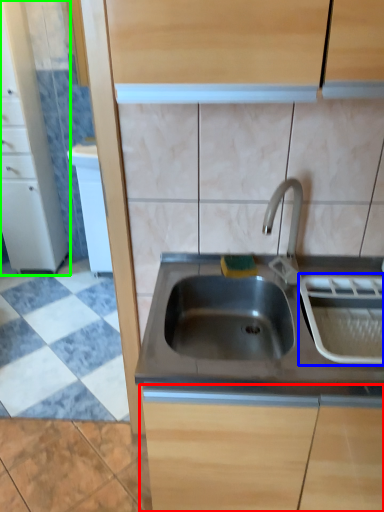
Question: Based on their relative distances, which object is nearer to cabinetry (highlighted by a red box)? Choose from appliance (highlighted by a blue box) and cabinetry (highlighted by a green box).

Choices:
 (A) appliance
 (B) cabinetry

Answer: (A)